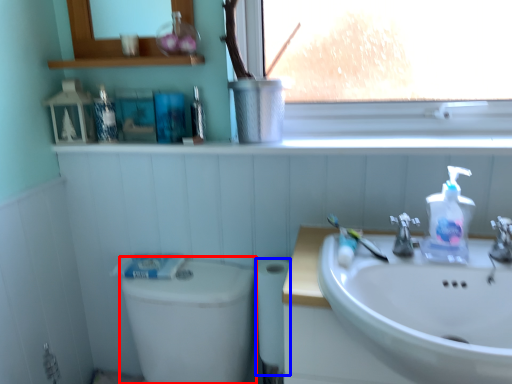
Question: Which object is closer to the camera taking this photo, toilet bowl (highlighted by a red box) or toilet paper (highlighted by a blue box)?

Choices:
 (A) toilet bowl
 (B) toilet paper

Answer: (A)